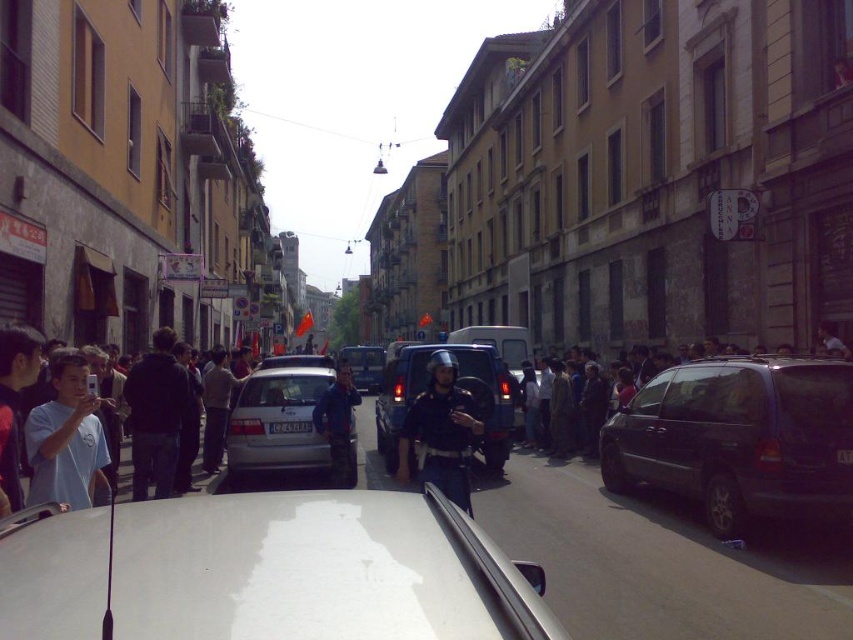
Question: Which point is farther to the camera?

Choices:
 (A) (15, 368)
 (B) (440, 426)
 (C) (22, 614)

Answer: (B)

Question: Among these objects, which one is nearest to the camera?

Choices:
 (A) dark blue matte suv at center
 (B) blue fabric jacket at center

Answer: (A)

Question: Can you confirm if white glossy car at center is wider than blue fabric jacket at center?

Choices:
 (A) no
 (B) yes

Answer: (A)

Question: Among these objects, which one is nearest to the camera?

Choices:
 (A) dark blue fabric jacket at left
 (B) blue fabric jacket at center

Answer: (A)

Question: Is dark blue matte suv at center bigger than dark blue uniform at center?

Choices:
 (A) no
 (B) yes

Answer: (B)

Question: Can you confirm if white glossy car at center is wider than dark gray matte van at center-right?

Choices:
 (A) no
 (B) yes

Answer: (B)